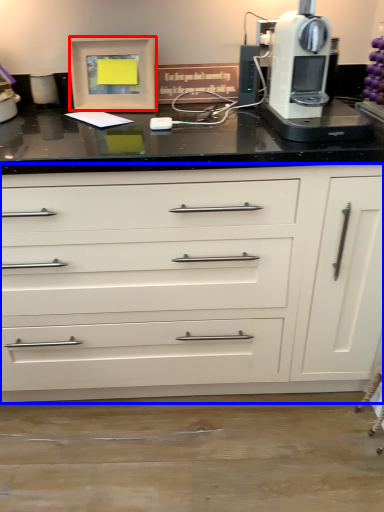
Question: Which point is further to the camera, picture frame (highlighted by a red box) or chest of drawers (highlighted by a blue box)?

Choices:
 (A) picture frame
 (B) chest of drawers

Answer: (A)